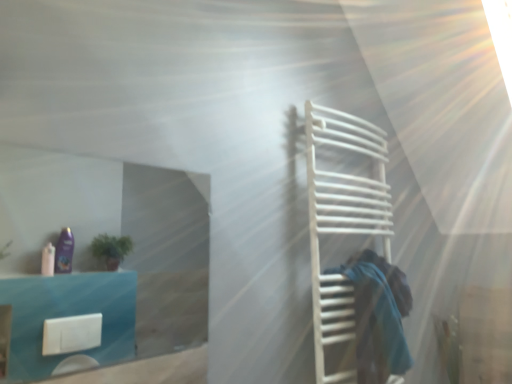
This screenshot has width=512, height=384. Find the location of `blue fabric at right`. blue fabric at right is located at coordinates (378, 316).

Considering the sizes of blue fabric at right and white matte towel rack at right in the image, is blue fabric at right taller or shorter than white matte towel rack at right?

blue fabric at right is shorter than white matte towel rack at right.

Does blue fabric at right appear on the right side of white matte towel rack at right?

No.

Could you tell me if blue fabric at right is facing white matte towel rack at right?

Yes, blue fabric at right is aimed at white matte towel rack at right.

Can we say blue fabric at right lies outside white matte towel rack at right?

No, blue fabric at right is inside white matte towel rack at right's boundary.

Which of these two, transparent glass door at upper left or blue fabric at right, is smaller?

transparent glass door at upper left.

What's the angular difference between transparent glass door at upper left and blue fabric at right's facing directions?

The angle between the facing direction of transparent glass door at upper left and the facing direction of blue fabric at right is 1.09 degrees.

From the image's perspective, relative to blue fabric at right, is transparent glass door at upper left above or below?

transparent glass door at upper left is above blue fabric at right.

The image size is (512, 384). In order to click on person below the transparent glass door at upper left (from a real-world perspective) in this screenshot , I will do `click(378, 316)`.

Is white matte towel rack at right shorter than transparent glass door at upper left?

In fact, white matte towel rack at right may be taller than transparent glass door at upper left.

Where is `glass door on the left side of white matte towel rack at right`? The width and height of the screenshot is (512, 384). glass door on the left side of white matte towel rack at right is located at coordinates (115, 232).

Is white matte towel rack at right beside transparent glass door at upper left?

No, white matte towel rack at right is not next to transparent glass door at upper left.

Which is more to the right, transparent glass door at upper left or white matte towel rack at right?

white matte towel rack at right.

Is white matte towel rack at right located within transparent glass door at upper left?

No, transparent glass door at upper left does not contain white matte towel rack at right.

Who is bigger, transparent glass door at upper left or white matte towel rack at right?

With larger size is white matte towel rack at right.

This screenshot has height=384, width=512. In the image, there is a transparent glass door at upper left. In order to click on person below it (from the image's perspective) in this screenshot , I will do `click(378, 316)`.

Is blue fabric at right bigger than transparent glass door at upper left?

Yes.

Which object is positioned more to the left, blue fabric at right or transparent glass door at upper left?

From the viewer's perspective, transparent glass door at upper left appears more on the left side.

Looking at this image, which of these two, white matte towel rack at right or blue fabric at right, is thinner?

blue fabric at right.

Does white matte towel rack at right turn towards blue fabric at right?

Yes, white matte towel rack at right is facing blue fabric at right.

Is point (327, 348) positioned before point (412, 359)?

Yes.

Considering the positions of objects white matte towel rack at right and blue fabric at right in the image provided, who is more to the left, white matte towel rack at right or blue fabric at right?

blue fabric at right.

This screenshot has width=512, height=384. Identify the location of cage located on the right of blue fabric at right. (343, 227).

At what (x,y) coordinates should I click in order to perform the action: click on glass door above the blue fabric at right (from a real-world perspective). Please return your answer as a coordinate pair (x, y). Looking at the image, I should click on (115, 232).

Considering their positions, is blue fabric at right positioned further to white matte towel rack at right than transparent glass door at upper left?

Among the two, transparent glass door at upper left is located further to white matte towel rack at right.

From the image, which object appears to be farther from transparent glass door at upper left, white matte towel rack at right or blue fabric at right?

blue fabric at right is positioned further to the anchor transparent glass door at upper left.

Estimate the real-world distances between objects in this image. Which object is further from white matte towel rack at right, transparent glass door at upper left or blue fabric at right?

The object further to white matte towel rack at right is transparent glass door at upper left.

From the image, which object appears to be nearer to blue fabric at right, transparent glass door at upper left or white matte towel rack at right?

Among the two, white matte towel rack at right is located nearer to blue fabric at right.

When comparing their distances from transparent glass door at upper left, does blue fabric at right or white matte towel rack at right seem closer?

white matte towel rack at right is closer to transparent glass door at upper left.

From the image, which object appears to be farther from blue fabric at right, white matte towel rack at right or transparent glass door at upper left?

transparent glass door at upper left.

This screenshot has height=384, width=512. I want to click on person between transparent glass door at upper left and white matte towel rack at right in the horizontal direction, so click(x=378, y=316).